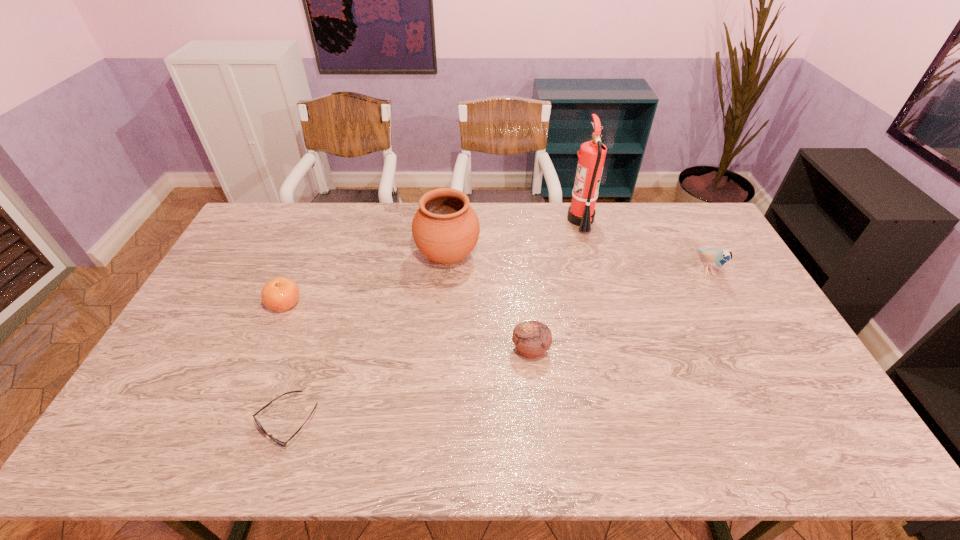
The width and height of the screenshot is (960, 540). Find the location of `vacant space in between the pottery and the muffin`. vacant space in between the pottery and the muffin is located at coordinates (490, 303).

The width and height of the screenshot is (960, 540). Find the location of `free space between the third nearest object and the tallest object`. free space between the third nearest object and the tallest object is located at coordinates (433, 261).

Where is `vacant space in between the fifth shortest object and the second object from left to right`? vacant space in between the fifth shortest object and the second object from left to right is located at coordinates (368, 339).

This screenshot has width=960, height=540. Find the location of `vacant area that lies between the fourth farthest object and the third object from right to left`. vacant area that lies between the fourth farthest object and the third object from right to left is located at coordinates (408, 327).

Where is `empty space between the fire extinguisher and the nearest object`? The height and width of the screenshot is (540, 960). empty space between the fire extinguisher and the nearest object is located at coordinates (434, 321).

Find the location of a particular element. Image resolution: width=960 pixels, height=540 pixels. free space between the fire extinguisher and the sunglasses is located at coordinates (434, 321).

Locate an element on the screen. unoccupied position between the muffin and the nearest object is located at coordinates (409, 386).

You are a GUI agent. You are given a task and a screenshot of the screen. Output one action in this format:
    pyautogui.click(x=<x>, y=<y>)
    Task: Click on the vacant point located between the clementine and the second object from left to right
    
    Given the screenshot: What is the action you would take?
    pyautogui.click(x=286, y=362)

Locate an element on the screen. This screenshot has height=540, width=960. unoccupied area between the muffin and the shortest object is located at coordinates (409, 386).

At what (x,y) coordinates should I click in order to perform the action: click on object that is the third closest to the muffin. Please return your answer as a coordinate pair (x, y). Looking at the image, I should click on (284, 444).